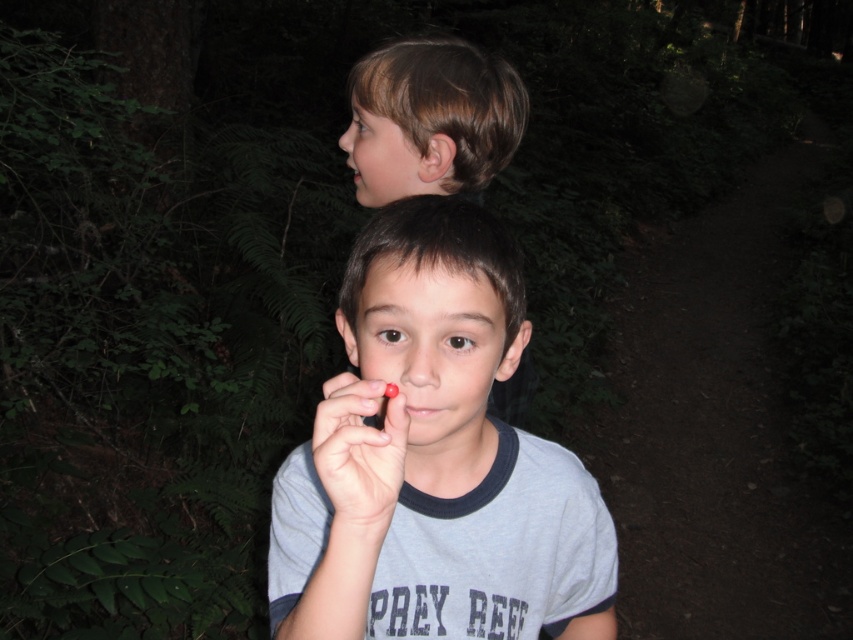
Based on the scene description, can you determine which object is smaller in size between the smooth skin face at center and the smooth brown hair at upper center?

The smooth skin face at center is smaller in size compared to the smooth brown hair at upper center.

You are a photographer trying to capture a photo of the two boys in the forest. You need to ensure that the gray cotton shirt at center and the brown hair at upper center are both clearly visible in the frame. Given their sizes, which object should you focus on to ensure both are in focus?

The gray cotton shirt at center is wider than the brown hair at upper center, so focusing on the gray cotton shirt at center would help ensure both objects are in focus as it occupies more space in the frame.

You are a photographer standing in front of the gray cotton shirt at center. You want to take a closeup photo of it without moving the shirt. Can you step forward to get closer?

The gray cotton shirt at center is 44.58 centimeters away from viewer. Since you can move closer, stepping forward would allow you to get within the desired distance for a closeup photo.